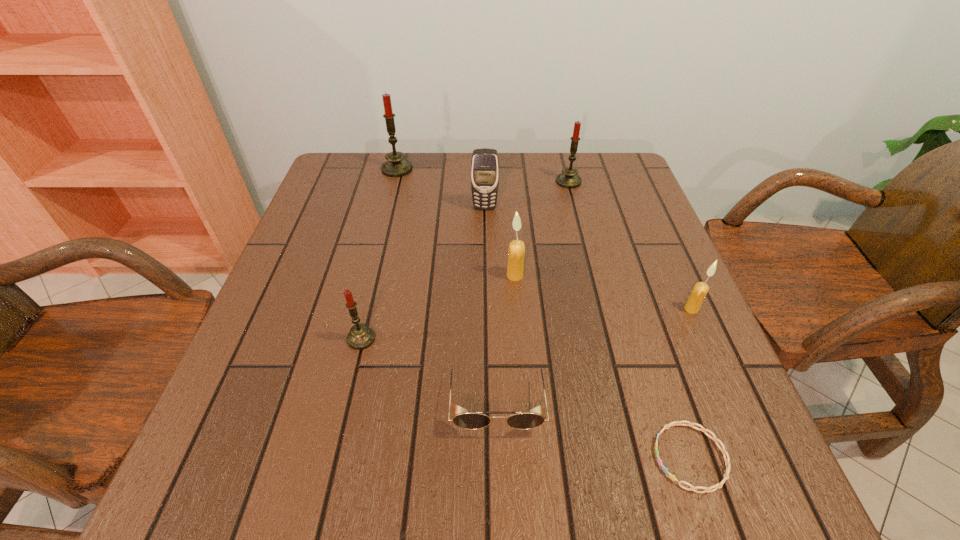
Where is `the rightmost object`? This screenshot has width=960, height=540. the rightmost object is located at coordinates (700, 290).

Find the location of `the seventh tallest object`. the seventh tallest object is located at coordinates (472, 421).

Locate an element on the screen. Image resolution: width=960 pixels, height=540 pixels. the shortest object is located at coordinates (727, 461).

Locate an element on the screen. This screenshot has width=960, height=540. blue bracelet is located at coordinates (727, 461).

I want to click on free region located 0.310m on the right of the biggest red candle, so click(x=519, y=170).

Identify the location of free space located on the left of the second smallest red candle. (524, 181).

Where is `vacant space located 0.140m on the back of the left cream candle`? This screenshot has width=960, height=540. vacant space located 0.140m on the back of the left cream candle is located at coordinates (512, 230).

Locate an element on the screen. The height and width of the screenshot is (540, 960). vacant space positioned on the front face of the third farthest object is located at coordinates (485, 226).

The height and width of the screenshot is (540, 960). Identify the location of vacant position located 0.060m on the right of the sixth farthest object. (406, 339).

Identify the location of free space located on the back of the smaller cream candle. The width and height of the screenshot is (960, 540). (679, 280).